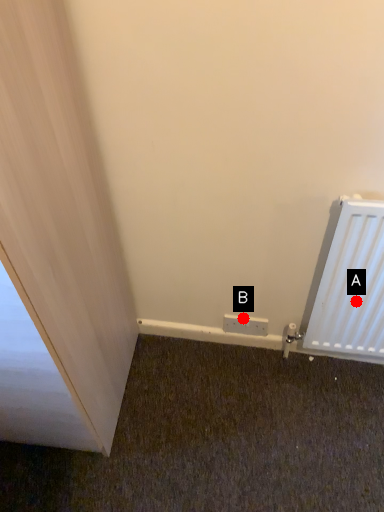
Question: Two points are circled on the image, labeled by A and B beside each circle. Which of the following is the closest to the observer?

Choices:
 (A) A is closer
 (B) B is closer

Answer: (A)